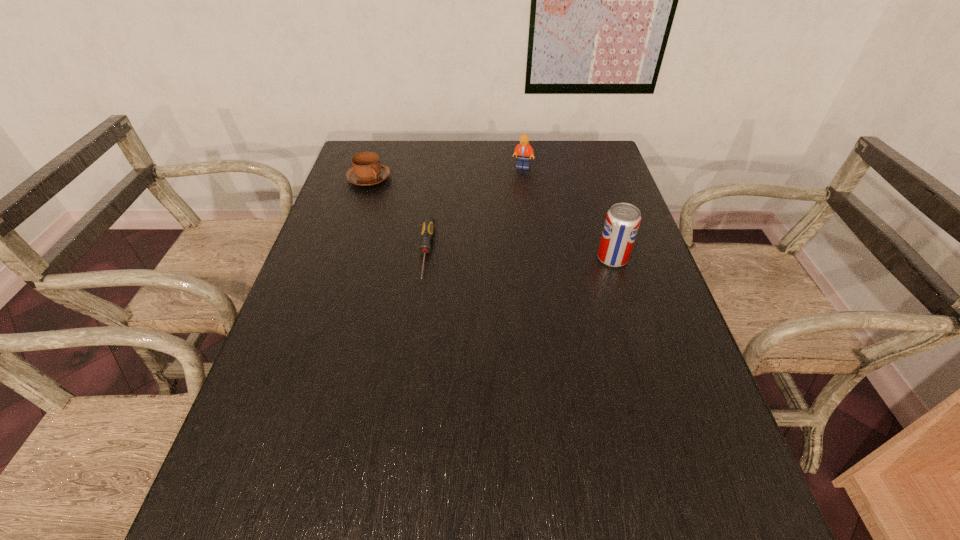
Image resolution: width=960 pixels, height=540 pixels. I want to click on screwdriver, so click(427, 232).

Image resolution: width=960 pixels, height=540 pixels. In order to click on the shortest object in this screenshot , I will do `click(427, 232)`.

Find the location of `soda`. soda is located at coordinates (622, 222).

This screenshot has height=540, width=960. I want to click on the rightmost object, so click(x=622, y=222).

Identify the location of the second object from right to left. (523, 150).

I want to click on Lego, so click(523, 150).

This screenshot has height=540, width=960. Identify the location of the leftmost object. (366, 170).

Locate an element on the screen. This screenshot has height=540, width=960. cappuccino is located at coordinates (366, 170).

You are a GUI agent. You are given a task and a screenshot of the screen. Output one action in this format:
    pyautogui.click(x=<x>, y=<y>)
    Task: Click on the free location located 0.050m insert the third object from right to left into a screw head
    Image resolution: width=960 pixels, height=540 pixels.
    Given the screenshot: What is the action you would take?
    pyautogui.click(x=420, y=299)

Locate an element on the screen. This screenshot has width=960, height=540. blank space located on the front of the soda is located at coordinates (654, 389).